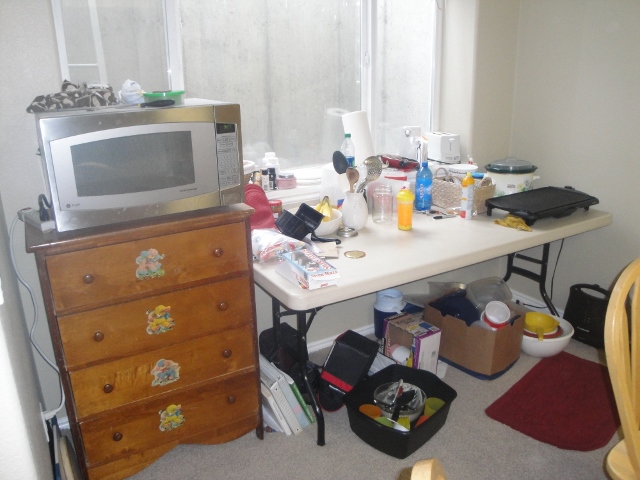
You are a GUI agent. You are given a task and a screenshot of the screen. Output one action in this format:
    pyautogui.click(x=<x>, y=<y>)
    Task: Click on the table top
    
    Given the screenshot: What is the action you would take?
    (450, 238)